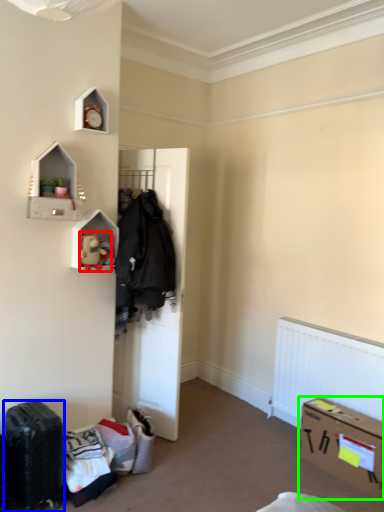
Question: Which is nearer to the toy (highlighted by a red box)? luggage (highlighted by a blue box) or box (highlighted by a green box).

Choices:
 (A) luggage
 (B) box

Answer: (A)